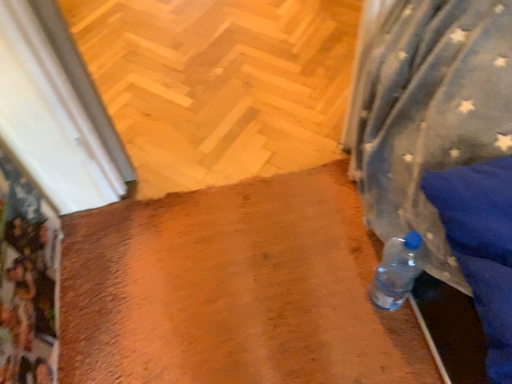
Describe the element at coordinates (219, 83) in the screenshot. I see `wooden floor at center` at that location.

Where is `wooden floor at center`? This screenshot has width=512, height=384. wooden floor at center is located at coordinates (219, 83).

This screenshot has height=384, width=512. Describe the element at coordinates (233, 290) in the screenshot. I see `clear plastic bottle at lower right` at that location.

Where is `clear plastic bottle at lower right`? This screenshot has width=512, height=384. clear plastic bottle at lower right is located at coordinates (233, 290).

What are the coordinates of `wooden floor at center` in the screenshot? It's located at (219, 83).

Which object is positioned more to the left, wooden floor at center or clear plastic bottle at lower right?

Positioned to the left is wooden floor at center.

Does wooden floor at center come in front of clear plastic bottle at lower right?

No, wooden floor at center is behind clear plastic bottle at lower right.

Considering the points (126, 108) and (287, 245), which point is in front, point (126, 108) or point (287, 245)?

The point (287, 245) is in front.

From the image's perspective, does wooden floor at center appear lower than clear plastic bottle at lower right?

No, from the image's perspective, wooden floor at center is not below clear plastic bottle at lower right.

From a real-world perspective, is wooden floor at center physically below clear plastic bottle at lower right?

Indeed, from a real-world perspective, wooden floor at center is positioned beneath clear plastic bottle at lower right.

Between wooden floor at center and clear plastic bottle at lower right, which one has smaller width?

Thinner between the two is clear plastic bottle at lower right.

Considering the relative sizes of wooden floor at center and clear plastic bottle at lower right in the image provided, is wooden floor at center shorter than clear plastic bottle at lower right?

No, wooden floor at center is not shorter than clear plastic bottle at lower right.

In terms of size, does wooden floor at center appear bigger or smaller than clear plastic bottle at lower right?

In the image, wooden floor at center appears to be larger than clear plastic bottle at lower right.

Can we say wooden floor at center lies outside clear plastic bottle at lower right?

Indeed, wooden floor at center is completely outside clear plastic bottle at lower right.

Is wooden floor at center beside clear plastic bottle at lower right?

They are not placed beside each other.

Is wooden floor at center positioned with its back to clear plastic bottle at lower right?

No, clear plastic bottle at lower right is not at the back of wooden floor at center.

Locate an element on the screen. wide lying in front of the wooden floor at center is located at coordinates (233, 290).

Between clear plastic bottle at lower right and wooden floor at center, which one appears on the left side from the viewer's perspective?

wooden floor at center is more to the left.

Is clear plastic bottle at lower right in front of or behind wooden floor at center in the image?

clear plastic bottle at lower right is in front of wooden floor at center.

Which point is more forward, (179, 267) or (256, 58)?

Positioned in front is point (179, 267).

From the image's perspective, which is above, clear plastic bottle at lower right or wooden floor at center?

wooden floor at center, from the image's perspective.

From a real-world perspective, between clear plastic bottle at lower right and wooden floor at center, who is vertically lower?

From a 3D spatial view, wooden floor at center is below.

Is clear plastic bottle at lower right wider or thinner than wooden floor at center?

Considering their sizes, clear plastic bottle at lower right looks slimmer than wooden floor at center.

Considering the sizes of objects clear plastic bottle at lower right and wooden floor at center in the image provided, who is shorter, clear plastic bottle at lower right or wooden floor at center?

clear plastic bottle at lower right is shorter.

Considering the sizes of clear plastic bottle at lower right and wooden floor at center in the image, is clear plastic bottle at lower right bigger or smaller than wooden floor at center?

clear plastic bottle at lower right is smaller than wooden floor at center.

Is wooden floor at center inside clear plastic bottle at lower right?

No, wooden floor at center is not surrounded by clear plastic bottle at lower right.

Are clear plastic bottle at lower right and wooden floor at center making contact?

They are not placed beside each other.

Is clear plastic bottle at lower right oriented towards wooden floor at center?

Yes, clear plastic bottle at lower right faces towards wooden floor at center.

Consider the image. How many degrees apart are the facing directions of clear plastic bottle at lower right and wooden floor at center?

The angle between the facing direction of clear plastic bottle at lower right and the facing direction of wooden floor at center is 177 degrees.

Measure the distance from clear plastic bottle at lower right to wooden floor at center.

clear plastic bottle at lower right and wooden floor at center are 19.46 inches apart.

Locate an element on the screen. This screenshot has width=512, height=384. wide located above the wooden floor at center (from a real-world perspective) is located at coordinates (233, 290).

Find the location of a particular element. This screenshot has height=384, width=512. path behind the clear plastic bottle at lower right is located at coordinates (219, 83).

The height and width of the screenshot is (384, 512). I want to click on path below the clear plastic bottle at lower right (from a real-world perspective), so click(x=219, y=83).